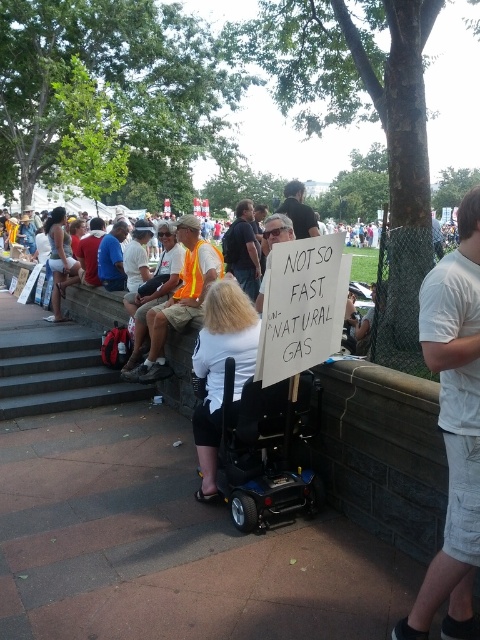
Question: Estimate the real-world distances between objects in this image. Which object is farther from the white cotton t-shirt at right?

Choices:
 (A) dark gray shirt at center
 (B) white plastic sign at center
 (C) dark blue shirt at center
 (D) black plastic wheelchair at center

Answer: (C)

Question: In this image, where is dark blue shirt at center located relative to dark gray shirt at center?

Choices:
 (A) below
 (B) above

Answer: (A)

Question: Is reflective orange vest at center in front of dark blue shirt at center?

Choices:
 (A) no
 (B) yes

Answer: (B)

Question: Which of the following is the closest to the observer?

Choices:
 (A) white plastic sign at center
 (B) white cotton t-shirt at right

Answer: (B)

Question: Does gray concrete stairs at lower left have a smaller size compared to dark blue shirt at center?

Choices:
 (A) yes
 (B) no

Answer: (A)

Question: Which is farther from the gray concrete stairs at lower left?

Choices:
 (A) dark gray shirt at center
 (B) dark blue shirt at center

Answer: (A)